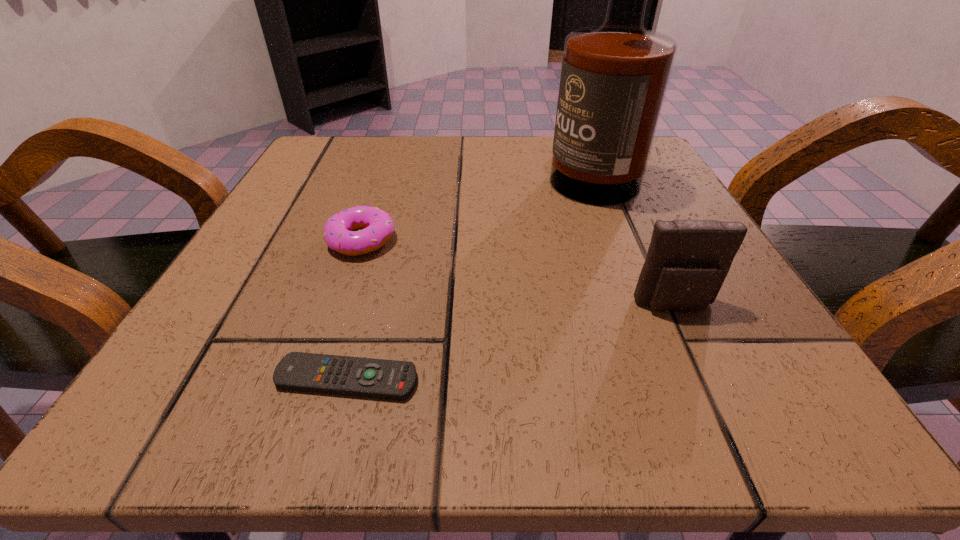
Identify the location of free area in between the third shortest object and the second shortest object. The image size is (960, 540). (517, 273).

At what (x,y) coordinates should I click in order to perform the action: click on vacant space that's between the second shortest object and the nearest object. Please return your answer as a coordinate pair (x, y). This screenshot has height=540, width=960. Looking at the image, I should click on (354, 309).

Find the location of a particular element. The width and height of the screenshot is (960, 540). vacant point located between the shortest object and the third farthest object is located at coordinates (511, 342).

This screenshot has width=960, height=540. I want to click on free space between the liquor and the third shortest object, so click(632, 237).

In order to click on empty space that is in between the second farthest object and the second tallest object in this screenshot , I will do `click(517, 273)`.

Where is `free space between the pouch and the second farthest object`? This screenshot has width=960, height=540. free space between the pouch and the second farthest object is located at coordinates (517, 273).

The height and width of the screenshot is (540, 960). I want to click on free space between the pouch and the third tallest object, so click(x=517, y=273).

The image size is (960, 540). I want to click on empty space that is in between the second tallest object and the second farthest object, so click(x=517, y=273).

This screenshot has width=960, height=540. Find the location of `empty location between the remote control and the doughnut`. empty location between the remote control and the doughnut is located at coordinates click(x=354, y=309).

Locate an element on the screen. The image size is (960, 540). object that stands as the third closest to the third tallest object is located at coordinates (687, 262).